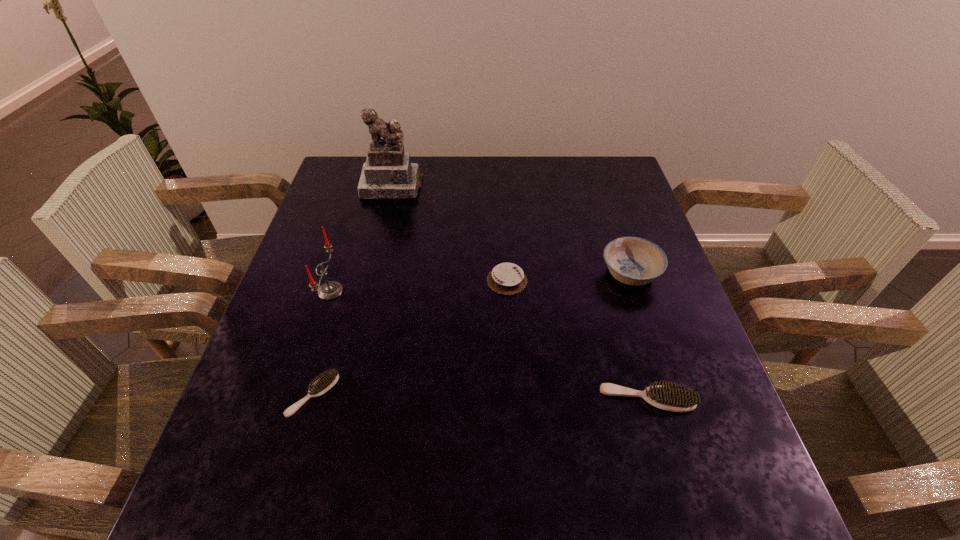
Identify the location of free space that satisfies the following two spatial constraints: 1. on the front-facing side of the candle; 2. on the back side of the shorter scrubbing brush. (298, 395).